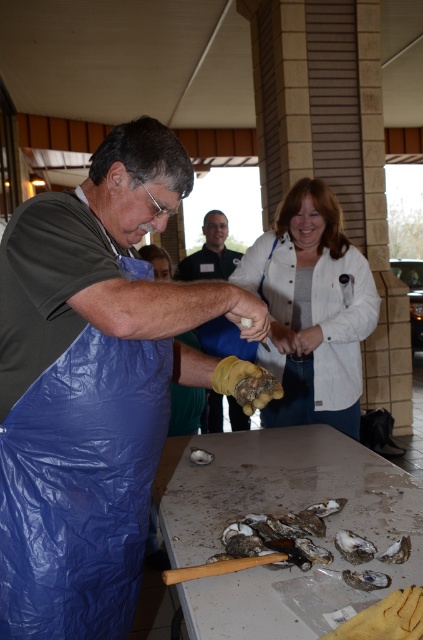
Does yellow rubber glove at center appear on the right side of white matte oyster at center?

In fact, yellow rubber glove at center is to the left of white matte oyster at center.

Identify the location of yellow rubber glove at center. (211, 252).

Looking at this image, does white plastic table at center have a lesser width compared to white shell oyster at center?

In fact, white plastic table at center might be wider than white shell oyster at center.

Does white plastic table at center appear under white shell oyster at center?

Correct, white plastic table at center is located below white shell oyster at center.

Image resolution: width=423 pixels, height=640 pixels. In order to click on white plastic table at center in this screenshot , I will do `click(288, 493)`.

Which is below, white shell oyster at center or smooth gray oyster at lower center?

smooth gray oyster at lower center is lower down.

Measure the distance from white shell oyster at center to smooth gray oyster at lower center.

A distance of 3.57 inches exists between white shell oyster at center and smooth gray oyster at lower center.

Which is in front, point (280, 552) or point (359, 561)?

Point (359, 561)

The image size is (423, 640). In order to click on white shell oyster at center in this screenshot , I will do `click(280, 536)`.